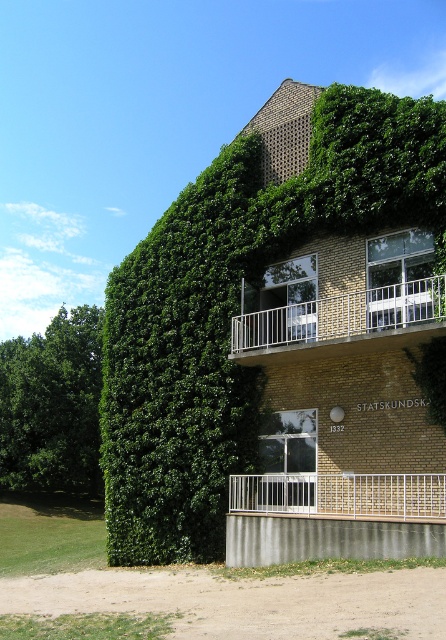
Question: Which of the following is the farthest from the observer?

Choices:
 (A) (156, 278)
 (B) (277, 337)
 (C) (331, 509)
 (D) (48, 465)

Answer: (D)

Question: Is green leafy tree at left positioned in front of white metal balcony at center?

Choices:
 (A) yes
 (B) no

Answer: (B)

Question: Which point appears closest to the camera in this image?

Choices:
 (A) (45, 349)
 (B) (429, 467)
 (C) (326, 506)
 (D) (297, 330)

Answer: (B)

Question: From the image, what is the correct spatial relationship of green leafy tree at center in relation to white metal balcony at center?

Choices:
 (A) left
 (B) right

Answer: (A)

Question: Can you confirm if green leafy tree at left is positioned to the left of white metal balcony at upper center?

Choices:
 (A) yes
 (B) no

Answer: (A)

Question: Which point is closer to the camera?

Choices:
 (A) (16, 417)
 (B) (247, 317)
 (C) (309, 513)

Answer: (C)